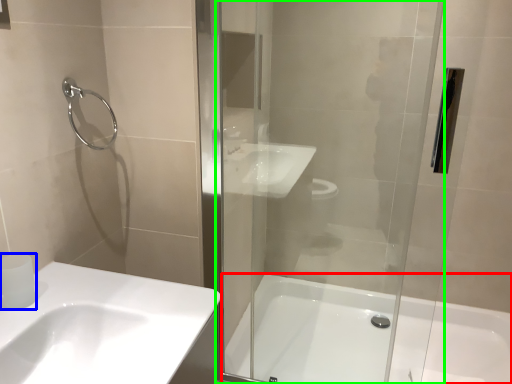
Question: Considering the real-world distances, which object is farthest from bathtub (highlighted by a red box)? toilet paper (highlighted by a blue box) or screen door (highlighted by a green box)?

Choices:
 (A) toilet paper
 (B) screen door

Answer: (A)